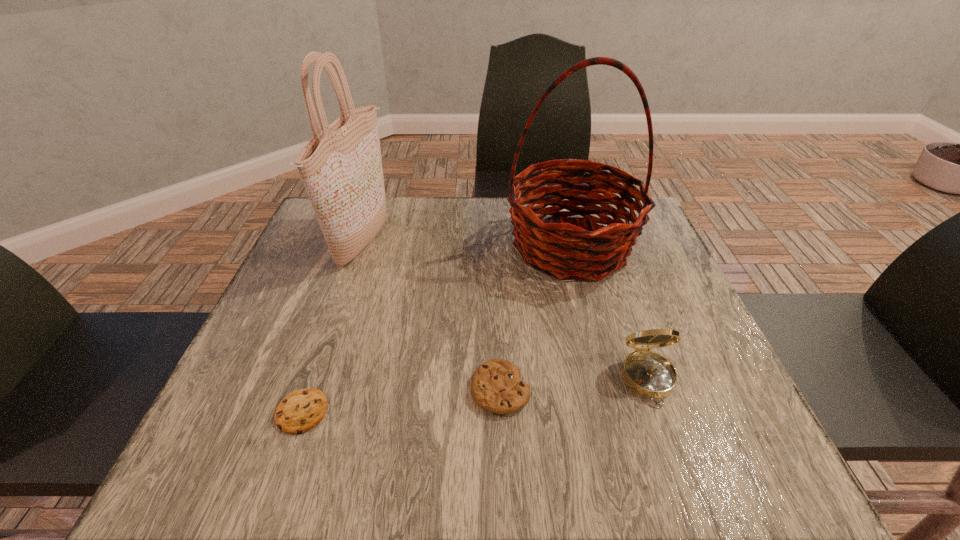
Where is `vacant area between the basket and the third tallest object`? The width and height of the screenshot is (960, 540). vacant area between the basket and the third tallest object is located at coordinates (610, 313).

Find the location of a particular element. free space between the compass and the taller cookie is located at coordinates (574, 385).

At what (x,y) coordinates should I click in order to perform the action: click on vacant space in between the compass and the right cookie. Please return your answer as a coordinate pair (x, y). Looking at the image, I should click on (574, 385).

Locate an element on the screen. The image size is (960, 540). free space that is in between the fourth tallest object and the basket is located at coordinates (536, 318).

Find the location of a particular element. This screenshot has height=540, width=960. unoccupied position between the third tallest object and the fourth tallest object is located at coordinates (574, 385).

You are a GUI agent. You are given a task and a screenshot of the screen. Output one action in this format:
    pyautogui.click(x=<x>, y=<y>)
    Task: Click on the vacant space that is in between the taller cookie and the basket
    Image resolution: width=960 pixels, height=540 pixels.
    Given the screenshot: What is the action you would take?
    pyautogui.click(x=536, y=318)

The width and height of the screenshot is (960, 540). Identify the location of object that is the fourth closest one to the shortest object. (648, 374).

Choose which object is the fourth nearest neighbor to the third tallest object. Please provide its 2D coordinates. Your answer should be formatted as a tuple, i.e. [(x, y)], where the tuple contains the x and y coordinates of a point satisfying the conditions above.

[(341, 167)]

Where is `vacant region that satisfies the following two spatial constraints: 1. on the front side of the shopping bag; 2. on the left side of the right cookie`? The height and width of the screenshot is (540, 960). vacant region that satisfies the following two spatial constraints: 1. on the front side of the shopping bag; 2. on the left side of the right cookie is located at coordinates (313, 389).

Identify the location of free location that satisfies the following two spatial constraints: 1. on the back side of the taller cookie; 2. on the right side of the basket. This screenshot has width=960, height=540. (494, 246).